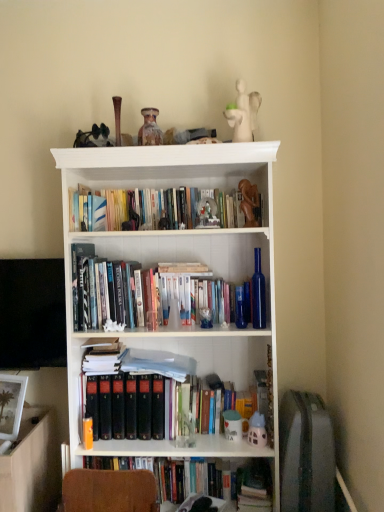
Question: Considering the relative sizes of white matte figurine at upper center, positioned as the 5th toy in bottom-to-top order, and speckled ceramic vase at upper center, which appears as the 1th toy when viewed from the left, in the image provided, is white matte figurine at upper center, positioned as the 5th toy in bottom-to-top order, taller than speckled ceramic vase at upper center, which appears as the 1th toy when viewed from the left,?

Choices:
 (A) no
 (B) yes

Answer: (B)

Question: Is white matte figurine at upper center, which is the third toy in right-to-left order, bigger than speckled ceramic vase at upper center, which appears as the 1th toy when viewed from the left?

Choices:
 (A) yes
 (B) no

Answer: (A)

Question: Is white matte figurine at upper center, positioned as the 5th toy in bottom-to-top order, placed right next to speckled ceramic vase at upper center, the 4th toy when ordered from bottom to top?

Choices:
 (A) yes
 (B) no

Answer: (B)

Question: Is white matte figurine at upper center, which is the third toy in right-to-left order, oriented towards speckled ceramic vase at upper center, positioned as the fifth toy in right-to-left order?

Choices:
 (A) no
 (B) yes

Answer: (A)

Question: Is white matte figurine at upper center, positioned as the 5th toy in bottom-to-top order, far away from speckled ceramic vase at upper center, positioned as the fifth toy in right-to-left order?

Choices:
 (A) yes
 (B) no

Answer: (B)

Question: Relative to hardcover books at upper center, is matte white toy at center, the 2th toy from the left, in front or behind?

Choices:
 (A) front
 (B) behind

Answer: (A)

Question: From the image's perspective, is matte white toy at center, the fifth toy in the top-to-bottom sequence, positioned above or below hardcover books at upper center?

Choices:
 (A) below
 (B) above

Answer: (A)

Question: In the image, is matte white toy at center, arranged as the first toy when ordered from the bottom, on the left side or the right side of hardcover books at upper center?

Choices:
 (A) left
 (B) right

Answer: (B)

Question: In terms of size, does matte white toy at center, the 2th toy from the left, appear bigger or smaller than hardcover books at upper center?

Choices:
 (A) small
 (B) big

Answer: (A)

Question: Is point (246, 182) closer or farther from the camera than point (226, 426)?

Choices:
 (A) farther
 (B) closer

Answer: (B)

Question: From their relative heights in the image, would you say wooden statue at upper center, arranged as the 2th toy when viewed from the right, is taller or shorter than matte white toy at center, the 2th toy from the left?

Choices:
 (A) short
 (B) tall

Answer: (B)

Question: Is wooden statue at upper center, arranged as the third toy when ordered from the bottom, inside or outside of matte white toy at center, the fifth toy in the top-to-bottom sequence?

Choices:
 (A) inside
 (B) outside

Answer: (B)

Question: Is wooden statue at upper center, marked as the third toy in a top-to-bottom arrangement, wider or thinner than matte white toy at center, the fifth toy in the top-to-bottom sequence?

Choices:
 (A) wide
 (B) thin

Answer: (B)

Question: Would you say matte white toy at center, the 4th toy from the right, is inside or outside translucent plastic toy at lower center, marked as the 1th toy in a right-to-left arrangement?

Choices:
 (A) inside
 (B) outside

Answer: (B)

Question: Is matte white toy at center, the 2th toy from the left, wider or thinner than translucent plastic toy at lower center, the second toy positioned from the bottom?

Choices:
 (A) wide
 (B) thin

Answer: (A)